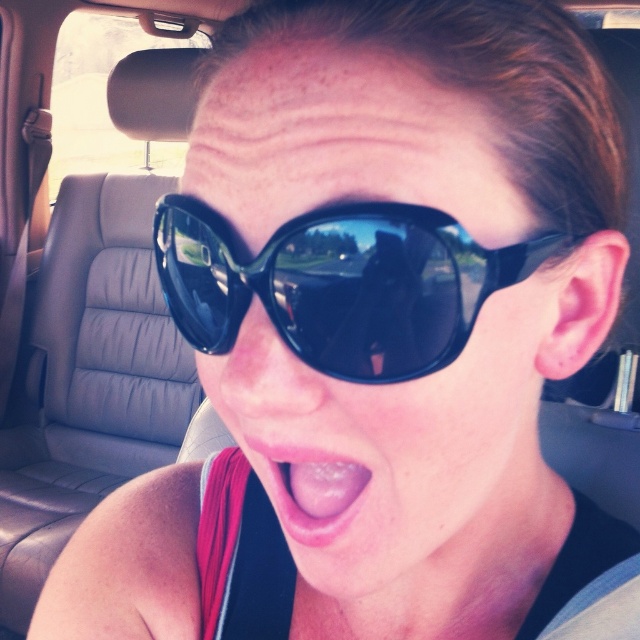
You are a car designer evaluating the placement of interior components. You notice the black plastic sunglasses at center and the black glossy sunglasses at center. Which of these sunglasses takes up more vertical space in the car?

The black plastic sunglasses at center takes up more vertical space in the car because it is much taller than the black glossy sunglasses at center.

You are a passenger in a car and want to adjust your sunglasses. The black plastic sunglasses at center are currently covering your view. Can you see the pink flesh at center without moving the sunglasses?

The black plastic sunglasses at center is located above pink flesh at center, so the sunglasses are blocking the view of the pink flesh at center unless moved.

You are a passenger in a car and want to place a small item between the two points labeled point (396, 280) and point (353, 508). Which point should you place it closer to if you want it to be closer to the front of the car?

You should place the item closer to point (396, 280) because it is in front of point (353, 508).